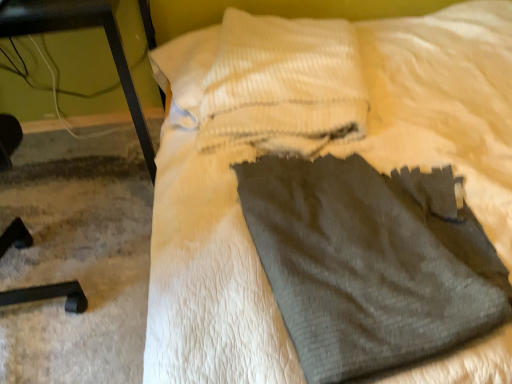
Question: Is white textured pillow at upper center closer to the viewer compared to dark gray fabric sweat pants at center?

Choices:
 (A) no
 (B) yes

Answer: (A)

Question: Are white textured pillow at upper center and dark gray fabric sweat pants at center far apart?

Choices:
 (A) no
 (B) yes

Answer: (A)

Question: Can you confirm if white textured pillow at upper center is bigger than dark gray fabric sweat pants at center?

Choices:
 (A) no
 (B) yes

Answer: (B)

Question: From the image's perspective, is white textured pillow at upper center over dark gray fabric sweat pants at center?

Choices:
 (A) no
 (B) yes

Answer: (B)

Question: Is white textured pillow at upper center wider than dark gray fabric sweat pants at center?

Choices:
 (A) no
 (B) yes

Answer: (B)

Question: Is white textured pillow at upper center taller or shorter than dark gray fabric sweat pants at center?

Choices:
 (A) tall
 (B) short

Answer: (A)

Question: From a real-world perspective, is white textured pillow at upper center positioned above or below dark gray fabric sweat pants at center?

Choices:
 (A) above
 (B) below

Answer: (A)

Question: Would you say white textured pillow at upper center is inside or outside dark gray fabric sweat pants at center?

Choices:
 (A) outside
 (B) inside

Answer: (A)

Question: Considering the positions of white textured pillow at upper center and dark gray fabric sweat pants at center in the image, is white textured pillow at upper center wider or thinner than dark gray fabric sweat pants at center?

Choices:
 (A) thin
 (B) wide

Answer: (B)

Question: Does point (470, 302) appear closer or farther from the camera than point (415, 72)?

Choices:
 (A) farther
 (B) closer

Answer: (B)

Question: Is dark gray fabric sweat pants at center bigger or smaller than gray fabric at center?

Choices:
 (A) big
 (B) small

Answer: (B)

Question: Is dark gray fabric sweat pants at center inside the boundaries of gray fabric at center, or outside?

Choices:
 (A) outside
 (B) inside

Answer: (B)

Question: Looking at their shapes, would you say dark gray fabric sweat pants at center is wider or thinner than gray fabric at center?

Choices:
 (A) wide
 (B) thin

Answer: (B)

Question: Considering the positions of gray fabric at center and black metal table at left in the image, is gray fabric at center wider or thinner than black metal table at left?

Choices:
 (A) thin
 (B) wide

Answer: (B)

Question: Considering the positions of gray fabric at center and black metal table at left in the image, is gray fabric at center taller or shorter than black metal table at left?

Choices:
 (A) tall
 (B) short

Answer: (B)